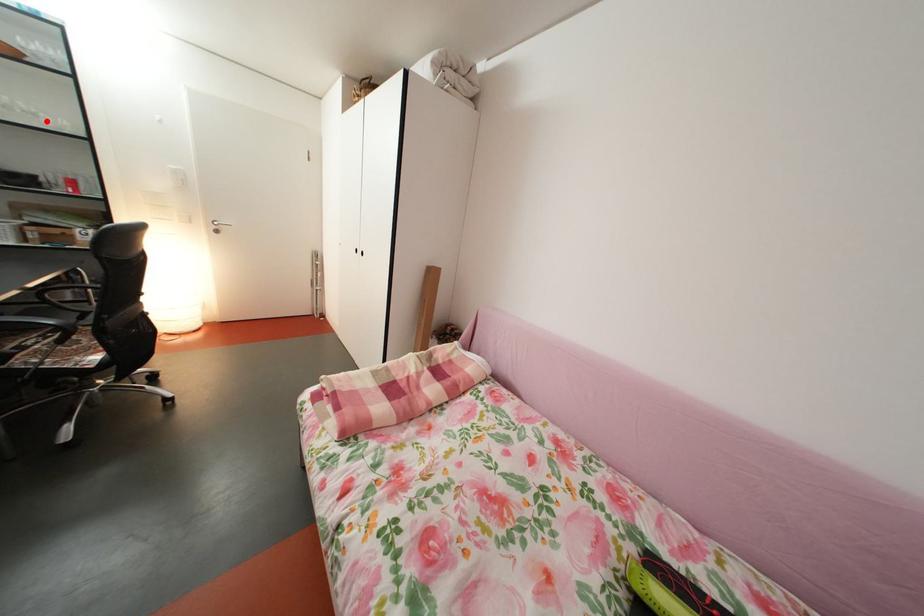
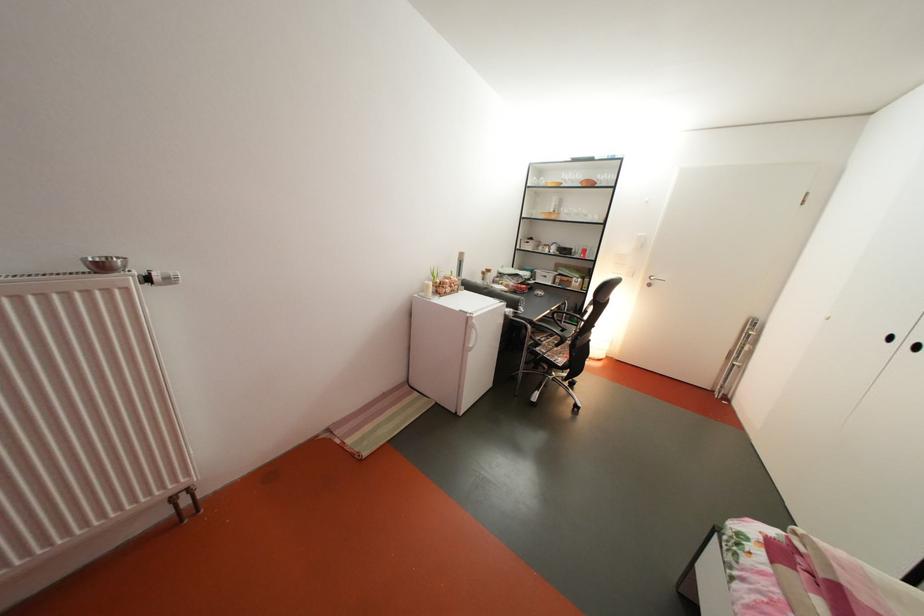
Question: I am providing you with two images of the same scene from different viewpoints. Image1 has a red point marked. In image2, the corresponding 3D location appears at what relative position? Reply with the corresponding letter.

Choices:
 (A) Closer
 (B) Farther

Answer: (A)